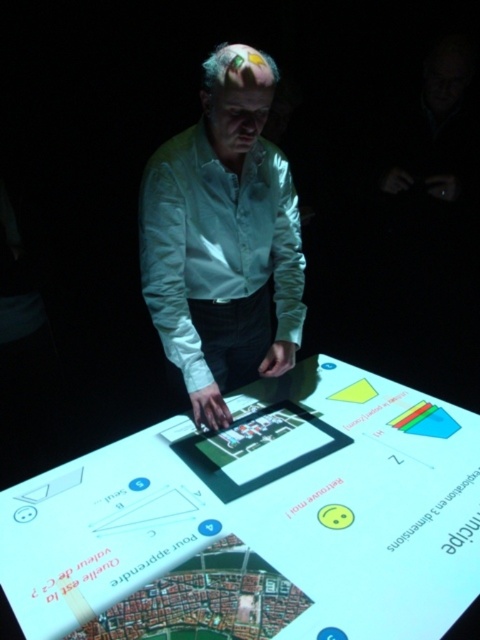
You are standing in front of the translucent glass table at center and the white silk shirt at center. Which object is closer to you?

The translucent glass table at center is closer to the viewer than the white silk shirt at center.

You are a visitor at the exhibit and want to take a photo of the translucent glass table at center without the white silk shirt at center blocking the view. Is the table tall enough to position yourself so the shirt is out of frame?

The translucent glass table at center is shorter than the white silk shirt at center, so positioning yourself so the shirt is out of frame might be challenging as the shirt is taller. You may need to crouch or move further back to ensure the shirt doesn

From the picture: You are standing in the museum and want to approach the translucent glass table at center. If you are currently at the origin point, which is the coordinate of the table?

The translucent glass table at center is located at coordinate point (x=259, y=520).